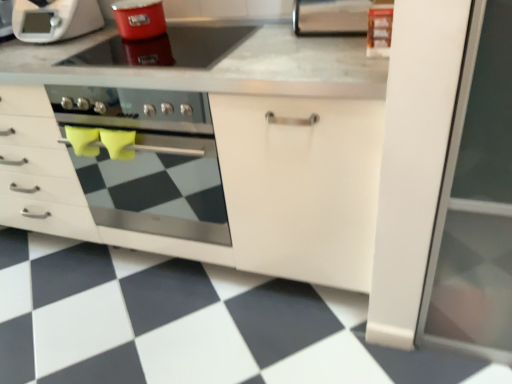
You are a GUI agent. You are given a task and a screenshot of the screen. Output one action in this format:
    pyautogui.click(x=<x>, y=<y>)
    Task: Click on the free space in front of metallic stainless steel paper towel holder at upper center
    This screenshot has height=384, width=512.
    Given the screenshot: What is the action you would take?
    pyautogui.click(x=320, y=46)